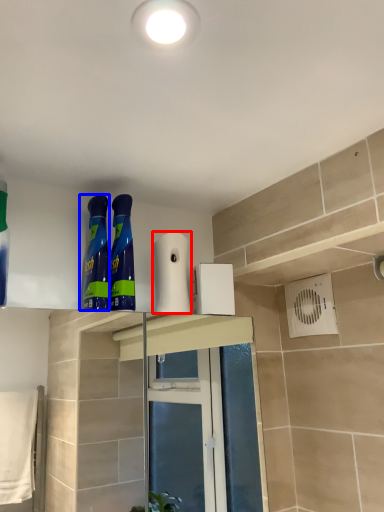
Question: Which object is further to the camera taking this photo, toilet paper (highlighted by a red box) or cleaning product (highlighted by a blue box)?

Choices:
 (A) toilet paper
 (B) cleaning product

Answer: (A)